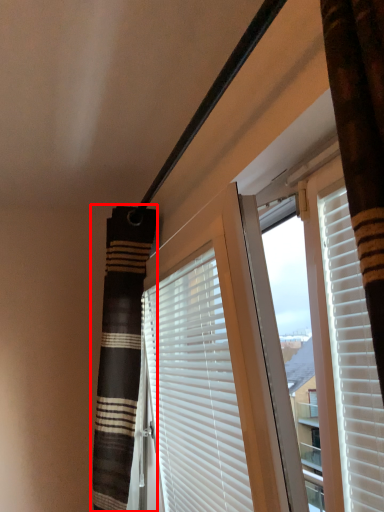
Question: From the image's perspective, what is the correct spatial positioning of shower curtain (annotated by the red box) in reference to window blind?

Choices:
 (A) above
 (B) below

Answer: (B)